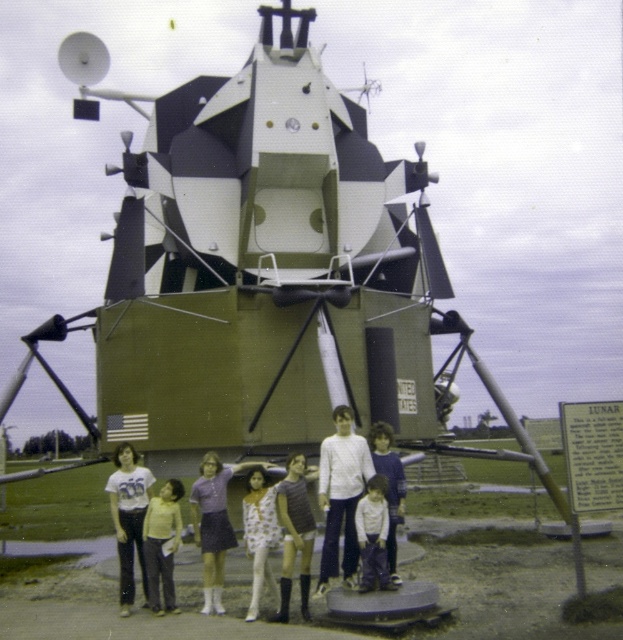
Who is lower down, white matte shirt at center or light brown fabric dress at center?

white matte shirt at center

Identify the location of white matte shirt at center. The width and height of the screenshot is (623, 640). 128,518.

Is the position of white matte pants at center more distant than that of white floral dress at center?

Yes, white matte pants at center is behind white floral dress at center.

Is white matte pants at center smaller than white floral dress at center?

No.

Describe the element at coordinates (340, 496) in the screenshot. I see `white matte pants at center` at that location.

Identify the location of white matte pants at center. (340, 496).

Which is behind, point (305, 566) or point (240, 500)?

The point (240, 500) is behind.

Does point (302, 577) come behind point (269, 528)?

No, (302, 577) is in front of (269, 528).

What do you see at coordinates (295, 531) in the screenshot? I see `white textured dress at center` at bounding box center [295, 531].

Where is `white textured dress at center`? The height and width of the screenshot is (640, 623). white textured dress at center is located at coordinates (295, 531).